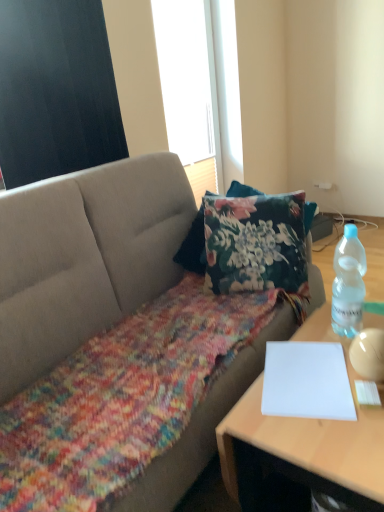
This screenshot has height=512, width=384. Find the location of `vacant area situated below white paper at lower right (from a real-world perspective)`. vacant area situated below white paper at lower right (from a real-world perspective) is located at coordinates (304, 378).